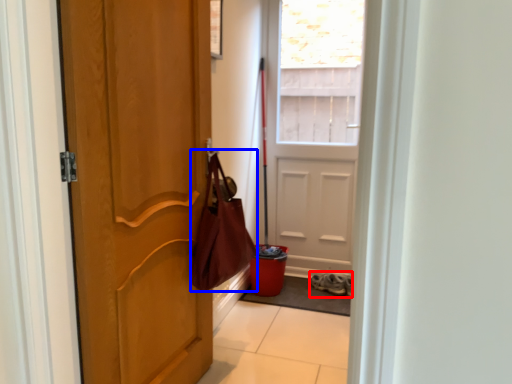
Question: Among these objects, which one is nearest to the camera, footwear (highlighted by a red box) or shoulder bag (highlighted by a blue box)?

Choices:
 (A) footwear
 (B) shoulder bag

Answer: (B)